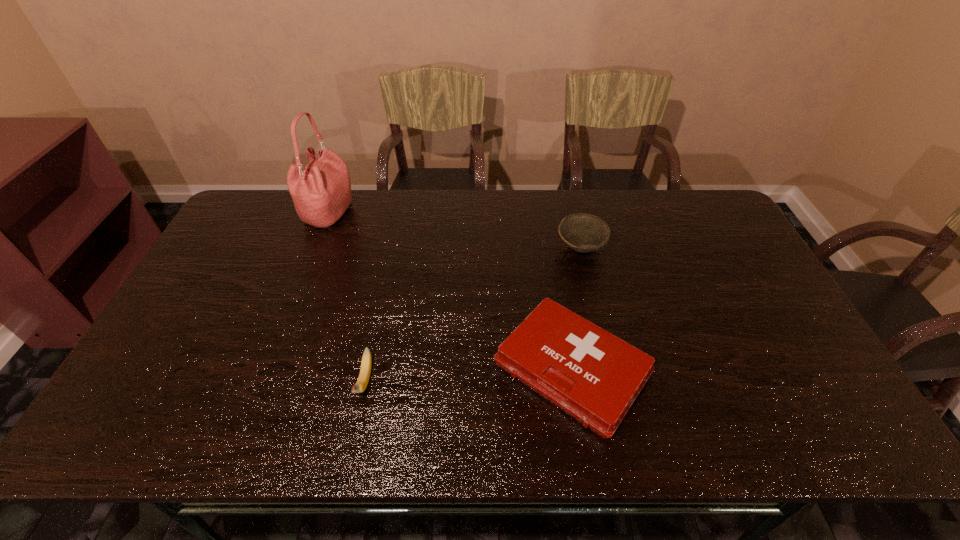
Where is `banana present at the near edge`? Image resolution: width=960 pixels, height=540 pixels. banana present at the near edge is located at coordinates [x=365, y=370].

Locate an element on the screen. the first-aid kit at the near edge is located at coordinates (594, 376).

Find the location of a particular element. This screenshot has height=540, width=960. vacant region at the far edge of the desktop is located at coordinates (395, 209).

Where is `vacant space at the near edge of the desktop`? The height and width of the screenshot is (540, 960). vacant space at the near edge of the desktop is located at coordinates (570, 433).

Find the location of a particular element. This screenshot has height=540, width=960. free space at the right edge is located at coordinates (731, 235).

You are a GUI agent. You are given a task and a screenshot of the screen. Output one action in this format:
    pyautogui.click(x=<x>, y=<y>)
    Task: Click on the vacant area at the far left corner
    
    Given the screenshot: What is the action you would take?
    pyautogui.click(x=279, y=212)

I want to click on free space at the near left corner of the desktop, so click(x=154, y=424).

The image size is (960, 540). I want to click on vacant area that lies between the bowl and the third object from right to left, so coord(472,314).

The height and width of the screenshot is (540, 960). In order to click on vacant space that is in between the bowl and the handbag in this screenshot , I will do `click(455, 231)`.

I want to click on free spot between the first-aid kit and the leftmost object, so click(x=450, y=291).